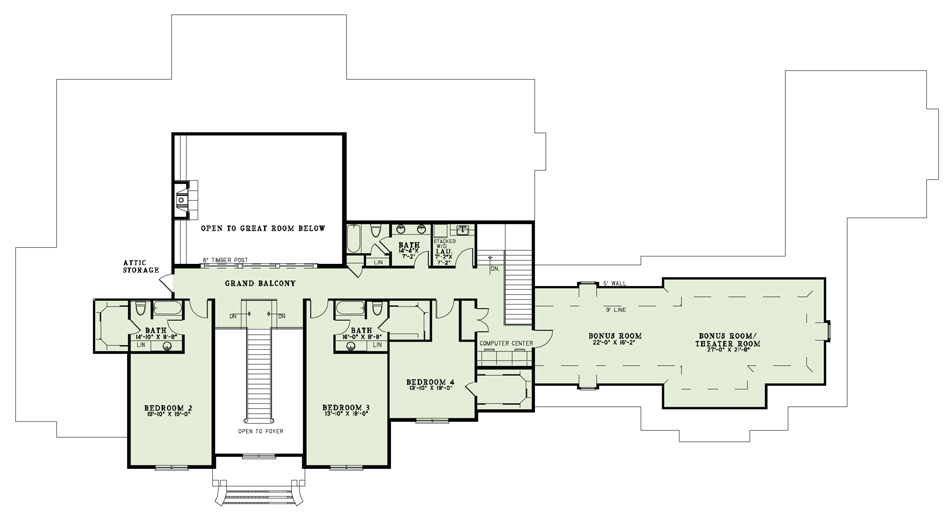
Where is `closet`? The height and width of the screenshot is (517, 950). closet is located at coordinates (509, 392), (117, 330).